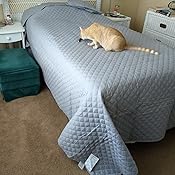
Identify the location of bed. (118, 78).